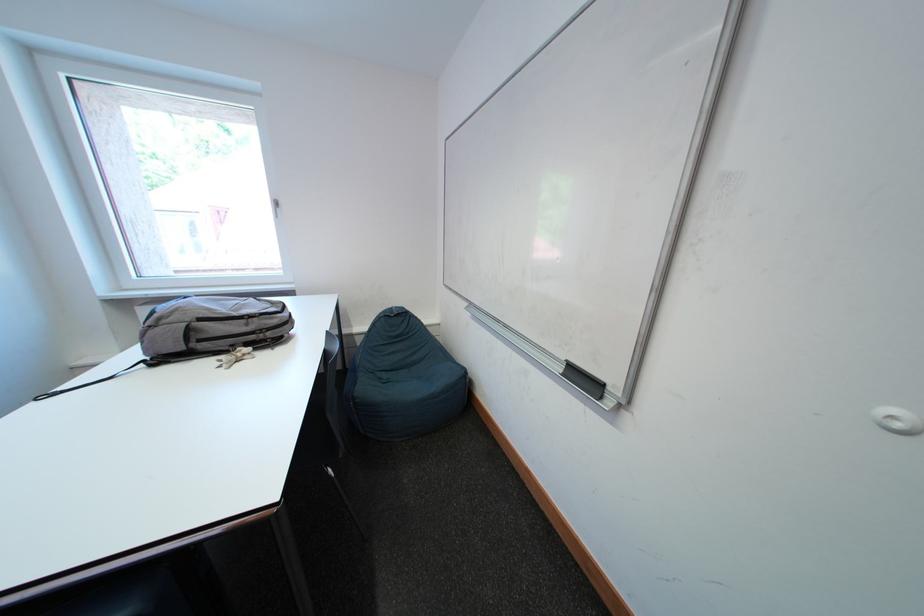
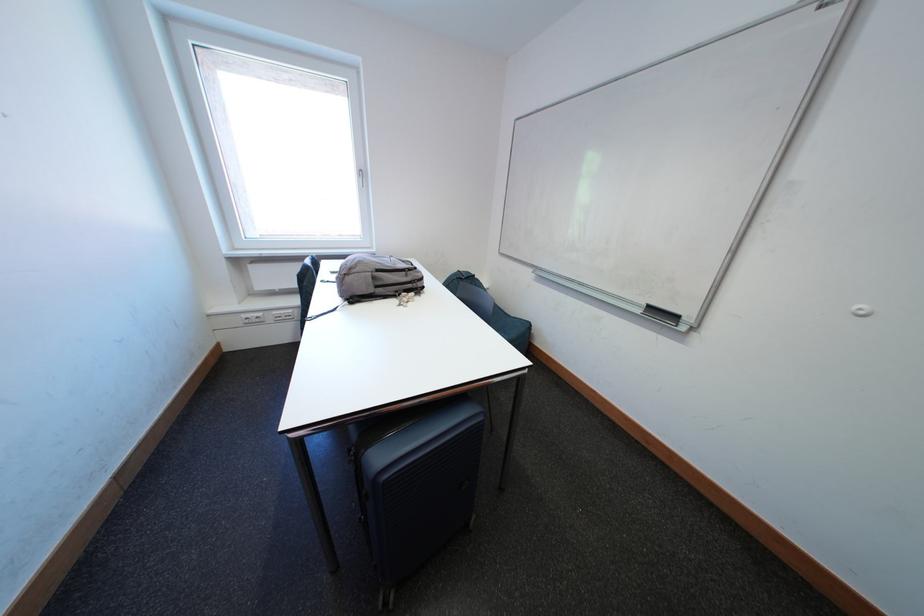
Question: I am providing you with two images of the same scene from different viewpoints. Please identify which objects are invisible in image2.

Choices:
 (A) whiteboard eraser
 (B) white window handle
 (C) backpack zipper pull
 (D) none of these

Answer: (D)